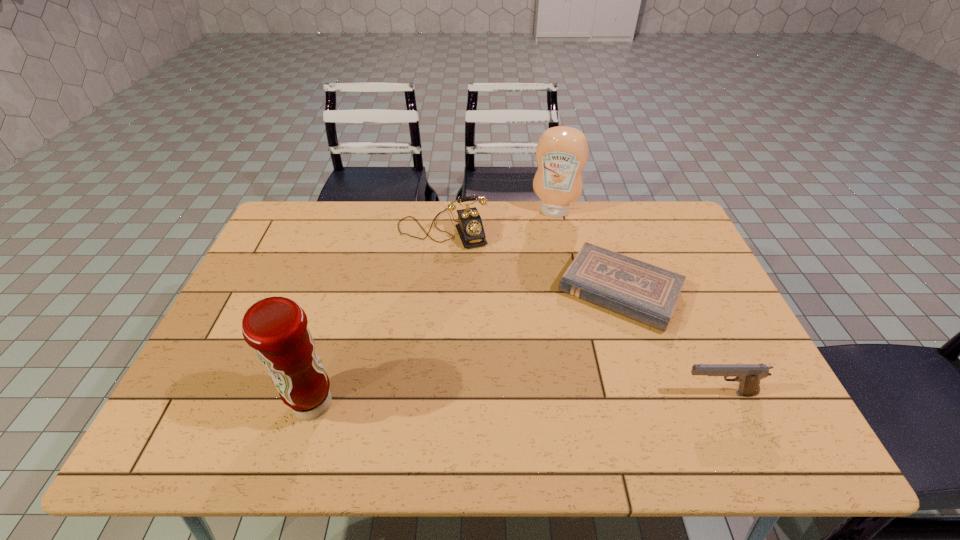
Find the location of a particular element. vacant space at the near right corner of the desktop is located at coordinates (722, 403).

Image resolution: width=960 pixels, height=540 pixels. In order to click on vacant space that's between the shortest object and the telephone in this screenshot , I will do `click(531, 260)`.

At what (x,y) coordinates should I click in order to perform the action: click on unoccupied position between the nearer condiment and the fourth object from right to left. Please return your answer as a coordinate pair (x, y). Looking at the image, I should click on (377, 316).

Find the location of a particular element. free area in between the nearer condiment and the farther condiment is located at coordinates (433, 307).

What are the coordinates of `blank region between the Bible and the pistol` in the screenshot? It's located at (669, 342).

Find the location of `empty space that is in between the fourth object from right to left and the farther condiment`. empty space that is in between the fourth object from right to left and the farther condiment is located at coordinates (498, 220).

Point out which object is positioned as the third nearest to the fourth object from right to left. Please provide its 2D coordinates. Your answer should be formatted as a tuple, i.e. [(x, y)], where the tuple contains the x and y coordinates of a point satisfying the conditions above.

[(276, 327)]

Locate an element on the screen. object that stands as the closest to the fourth tallest object is located at coordinates (638, 290).

Identify the location of vacant space that satisfies the following two spatial constraints: 1. on the front side of the telephone; 2. at the barrel of the pistol. pyautogui.click(x=426, y=394).

What are the coordinates of `vacant space that satisfies the following two spatial constraints: 1. on the front side of the second object from left to right; 2. at the barrel of the fourth tallest object` in the screenshot? It's located at (426, 394).